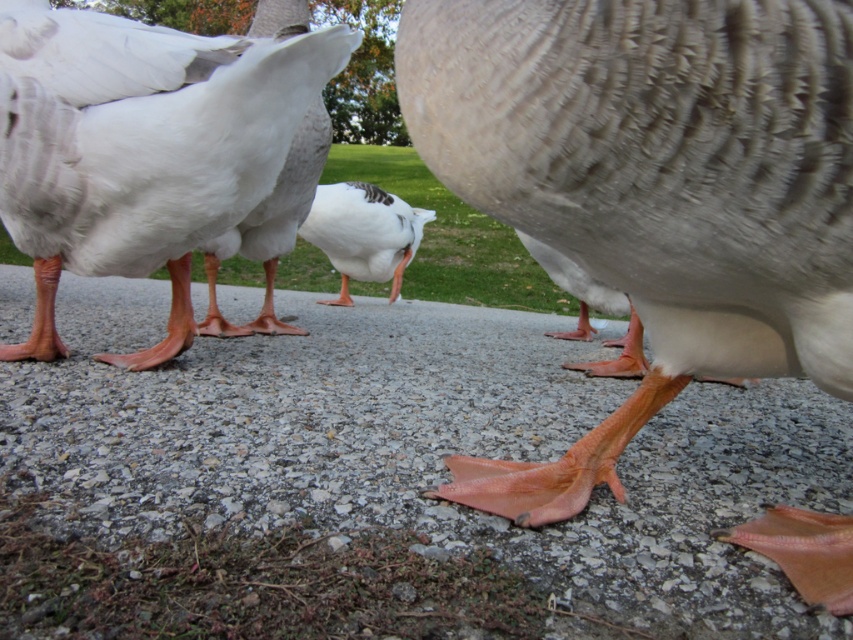
You are a child playing with two ducks in a pond. You notice the orange rubber duck feet at center and the matte gray duck foot at center. Which duck has bigger feet?

The orange rubber duck feet at center has a larger size compared to the matte gray duck foot at center, so the duck with orange rubber duck feet at center has bigger feet.

You are a park visitor who wants to place a small treat between the orange rubber duck feet at center and the matte white duck at lower left. Which duck should you place the treat closer to if you want it to be equally accessible to both?

The treat should be placed closer to the matte white duck at lower left because the orange rubber duck feet at center is larger, so positioning the treat nearer to the smaller duck ensures equal accessibility for both.